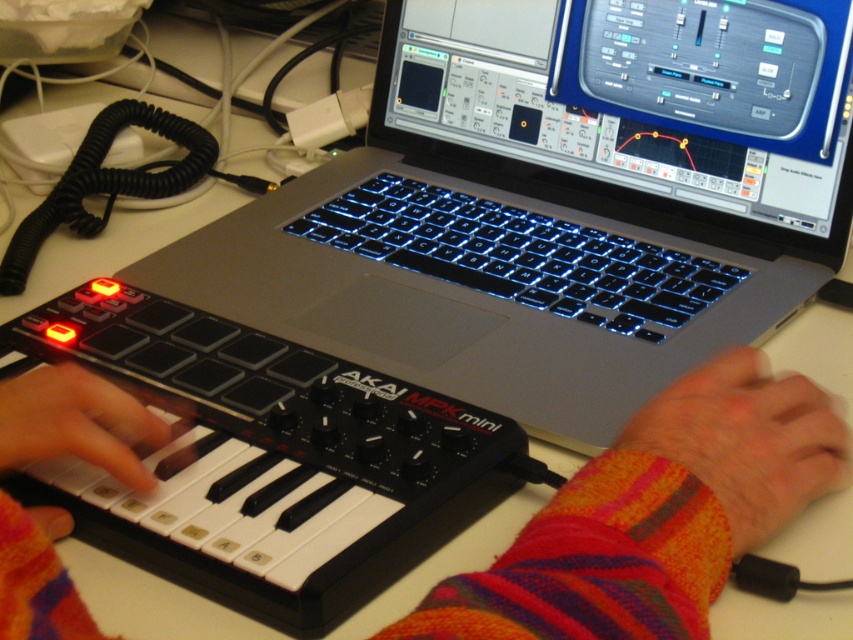
Question: Is sleek silver laptop at center positioned before white matte keyboard at lower left?

Choices:
 (A) yes
 (B) no

Answer: (B)

Question: Which of the following is the closest to the observer?

Choices:
 (A) knitted fabric wristband at lower right
 (B) glossy plastic keyboard at center

Answer: (A)

Question: Does sleek silver laptop at center have a larger size compared to white matte keyboard at lower left?

Choices:
 (A) yes
 (B) no

Answer: (A)

Question: Does plaid sweater at lower left have a smaller size compared to knitted fabric wristband at lower right?

Choices:
 (A) no
 (B) yes

Answer: (A)

Question: Which point is closer to the camera taking this photo?

Choices:
 (A) (218, 276)
 (B) (161, 429)
 (C) (810, 468)
 (D) (753, 422)

Answer: (D)

Question: Which point is closer to the camera?

Choices:
 (A) plaid sweater at lower left
 (B) knitted fabric wristband at lower right

Answer: (A)